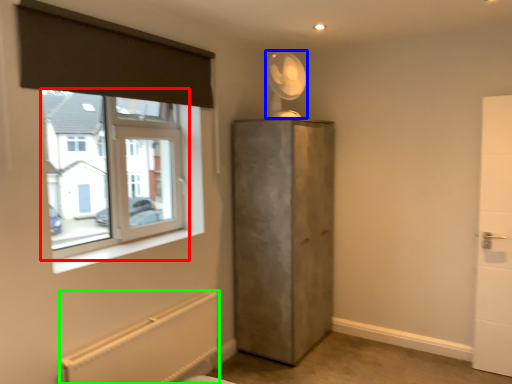
Question: Estimate the real-world distances between objects in this image. Which object is farther from window (highlighted by a red box), fan (highlighted by a blue box) or radiator (highlighted by a green box)?

Choices:
 (A) fan
 (B) radiator

Answer: (A)